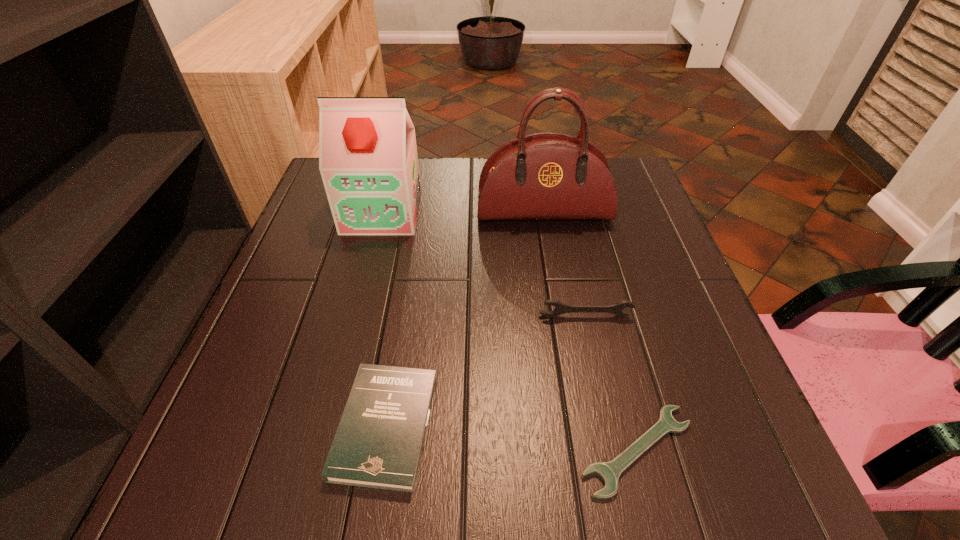
At what (x,y) coordinates should I click in order to perform the action: click on blank region between the taller wrench and the book. Please return your answer as a coordinate pair (x, y). Looking at the image, I should click on (486, 371).

The width and height of the screenshot is (960, 540). Find the location of `vacant area that lies between the book and the soya milk`. vacant area that lies between the book and the soya milk is located at coordinates (384, 319).

You are a GUI agent. You are given a task and a screenshot of the screen. Output one action in this format:
    pyautogui.click(x=<x>, y=<y>)
    Task: Click on the unoccupied area between the soya milk and the handbag
    This screenshot has height=540, width=960.
    Given the screenshot: What is the action you would take?
    pos(463,212)

At what (x,y) coordinates should I click in order to perform the action: click on free area in between the shortest object and the book. Please return your answer as a coordinate pair (x, y). Looking at the image, I should click on (512, 438).

Select which object is the fourth closest to the shortest object. Please provide its 2D coordinates. Your answer should be formatted as a tuple, i.e. [(x, y)], where the tuple contains the x and y coordinates of a point satisfying the conditions above.

[(368, 161)]

Image resolution: width=960 pixels, height=540 pixels. Identify the location of the fourth closest object to the nearer wrench. (368, 161).

I want to click on vacant position in the image that satisfies the following two spatial constraints: 1. with the cap open on the second shortest object; 2. on the right side of the soya milk, so click(x=326, y=426).

What are the coordinates of `free space that satisfies the following two spatial constraints: 1. on the open ends of the shortest object; 2. on the right side of the taller wrench` in the screenshot? It's located at (614, 450).

In order to click on vacant area in the image that satisfies the following two spatial constraints: 1. with the cap open on the shortest object; 2. on the right side of the soya milk in this screenshot , I will do `click(321, 450)`.

Where is `free space that satisfies the following two spatial constraints: 1. on the open ends of the shorter wrench; 2. on the right side of the taller wrench`? free space that satisfies the following two spatial constraints: 1. on the open ends of the shorter wrench; 2. on the right side of the taller wrench is located at coordinates (614, 450).